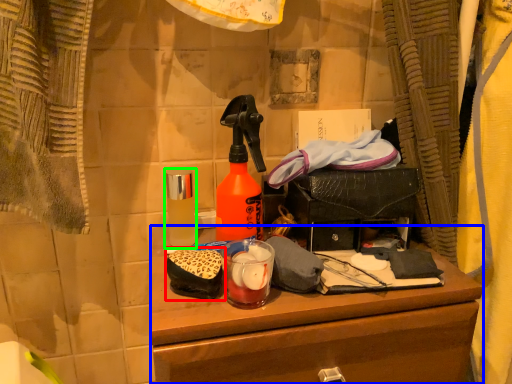
Question: Which object is positioned closest to debris (highlighted by a red box)? Select from desk (highlighted by a blue box) and bottle (highlighted by a green box).

Choices:
 (A) desk
 (B) bottle

Answer: (B)